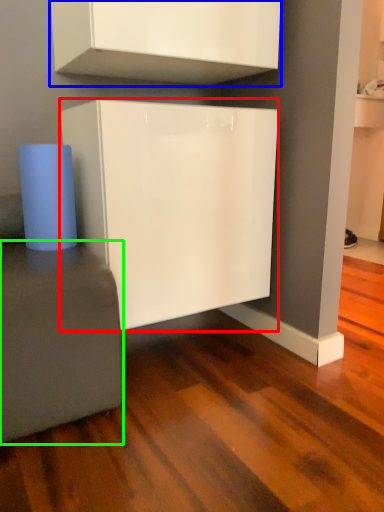
Question: Based on their relative distances, which object is farther from cabinetry (highlighted by a red box)? Choose from cabinetry (highlighted by a blue box) and furniture (highlighted by a green box).

Choices:
 (A) cabinetry
 (B) furniture

Answer: (A)